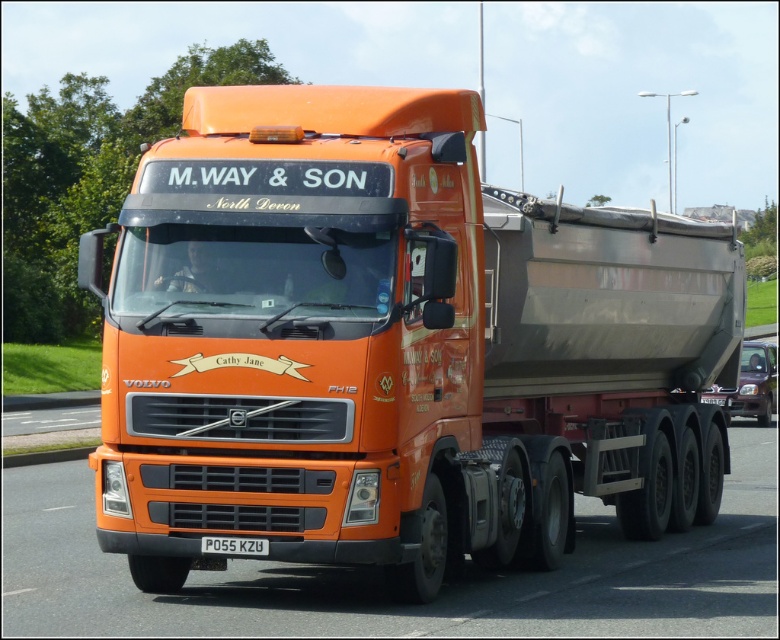
You are a traffic officer observing a vehicle with an orange matte truck at center and a red plastic license plate at center. Which object is positioned higher from the ground?

The orange matte truck at center is positioned higher from the ground than the red plastic license plate at center, as it is above it.

You are a delivery driver who needs to pass through a narrow tunnel that only allows vehicles up to the width of the red plastic license plate at center. Can the orange matte truck at center fit through the tunnel?

The orange matte truck at center might be wider than red plastic license plate at center, so it may not fit through the tunnel designed for vehicles up to the width of the red plastic license plate at center.